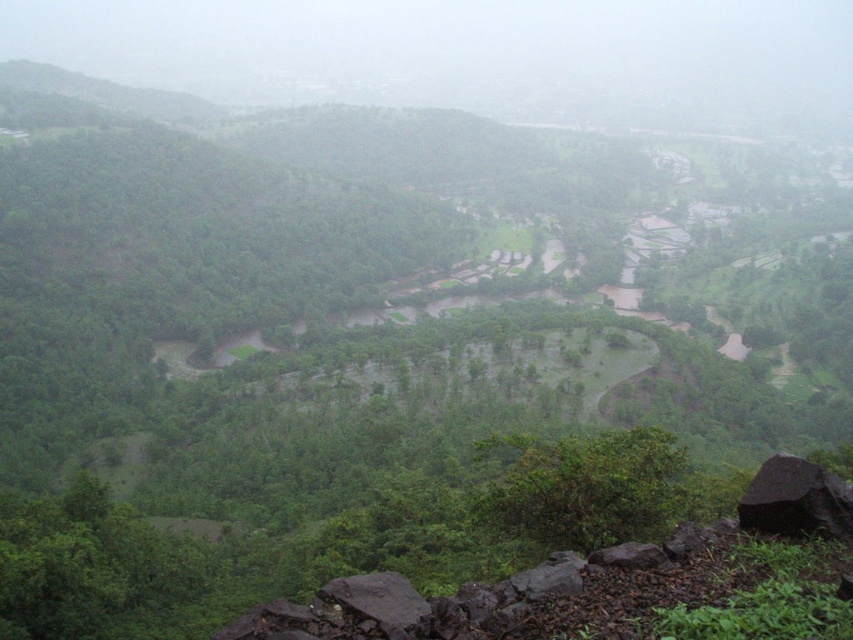
Question: Is black rock at lower right above dark gray rock at lower center?

Choices:
 (A) yes
 (B) no

Answer: (A)

Question: Is black rock at lower right to the left of dark gray rock at lower center from the viewer's perspective?

Choices:
 (A) yes
 (B) no

Answer: (B)

Question: Which point is farther from the camera taking this photo?

Choices:
 (A) (839, 497)
 (B) (352, 580)

Answer: (A)

Question: Among these points, which one is nearest to the camera?

Choices:
 (A) (396, 624)
 (B) (795, 493)

Answer: (A)

Question: Is black rock at lower right bigger than dark gray rock at lower center?

Choices:
 (A) yes
 (B) no

Answer: (B)